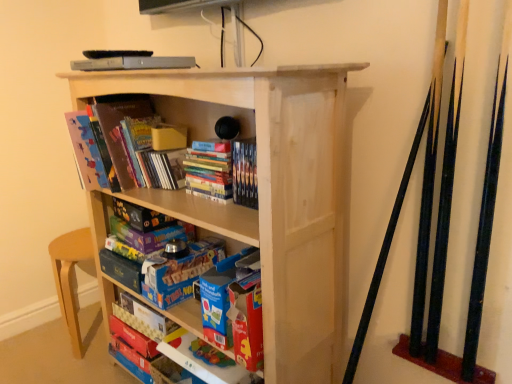
This screenshot has width=512, height=384. What do you see at coordinates (223, 171) in the screenshot?
I see `hardcover books at center, which appears as the 2th book when ordered from the bottom` at bounding box center [223, 171].

Measure the distance between matte cardboard book at left, which appears as the third book when ordered from the bottom, and camera.

matte cardboard book at left, which appears as the third book when ordered from the bottom, and camera are 3.73 feet apart.

The width and height of the screenshot is (512, 384). In order to click on natural wood bookcase at center in this screenshot , I will do `click(268, 193)`.

The height and width of the screenshot is (384, 512). Identify the location of hardcover books at center, which appears as the 2th book when ordered from the bottom. (223, 171).

From a real-world perspective, does hardcover books at center, which appears as the 2th book when ordered from the bottom, sit lower than matte cardboard book at left, which appears as the first book when viewed from the top?

Yes, from a real-world perspective, hardcover books at center, which appears as the 2th book when ordered from the bottom, is under matte cardboard book at left, which appears as the first book when viewed from the top.

Between hardcover books at center, which appears as the 2th book when ordered from the bottom, and matte cardboard book at left, which appears as the first book when viewed from the top, which one is positioned in front?

hardcover books at center, which appears as the 2th book when ordered from the bottom, is closer to the camera.

How much distance is there between hardcover books at center, the 2th book in the top-to-bottom sequence, and matte cardboard book at left, which appears as the third book when ordered from the bottom?

The distance of hardcover books at center, the 2th book in the top-to-bottom sequence, from matte cardboard book at left, which appears as the third book when ordered from the bottom, is 6.91 inches.

Looking at this image, is hardcover books at center, which appears as the 2th book when ordered from the bottom, thinner than matte cardboard book at left, which appears as the third book when ordered from the bottom?

Indeed, hardcover books at center, which appears as the 2th book when ordered from the bottom, has a lesser width compared to matte cardboard book at left, which appears as the third book when ordered from the bottom.

Is matte cardboard book at lower center, which is counted as the 1th book, starting from the bottom, situated inside hardcover books at center, the 2th book in the top-to-bottom sequence, or outside?

matte cardboard book at lower center, which is counted as the 1th book, starting from the bottom, cannot be found inside hardcover books at center, the 2th book in the top-to-bottom sequence.

Considering the relative sizes of matte cardboard book at lower center, which is counted as the 1th book, starting from the bottom, and hardcover books at center, the 2th book in the top-to-bottom sequence, in the image provided, is matte cardboard book at lower center, which is counted as the 1th book, starting from the bottom, taller than hardcover books at center, the 2th book in the top-to-bottom sequence,?

Incorrect, the height of matte cardboard book at lower center, which is counted as the 1th book, starting from the bottom, is not larger of that of hardcover books at center, the 2th book in the top-to-bottom sequence.

From the image's perspective, is matte cardboard book at lower center, which is counted as the 1th book, starting from the bottom, above or below hardcover books at center, which appears as the 2th book when ordered from the bottom?

matte cardboard book at lower center, which is counted as the 1th book, starting from the bottom, is situated lower than hardcover books at center, which appears as the 2th book when ordered from the bottom, in the image.

From a real-world perspective, is matte cardboard book at lower center, positioned as the third book in top-to-bottom order, beneath hardcover books at center, which appears as the 2th book when ordered from the bottom?

Yes, from a real-world perspective, matte cardboard book at lower center, positioned as the third book in top-to-bottom order, is beneath hardcover books at center, which appears as the 2th book when ordered from the bottom.

From their relative heights in the image, would you say matte cardboard book at lower center, positioned as the third book in top-to-bottom order, is taller or shorter than natural wood bookcase at center?

In the image, matte cardboard book at lower center, positioned as the third book in top-to-bottom order, appears to be shorter than natural wood bookcase at center.

Based on the photo, from the image's perspective, between matte cardboard book at lower center, which is counted as the 1th book, starting from the bottom, and natural wood bookcase at center, who is located below?

matte cardboard book at lower center, which is counted as the 1th book, starting from the bottom.

Considering the relative positions of matte cardboard book at lower center, positioned as the third book in top-to-bottom order, and natural wood bookcase at center in the image provided, is matte cardboard book at lower center, positioned as the third book in top-to-bottom order, in front of natural wood bookcase at center?

No, matte cardboard book at lower center, positioned as the third book in top-to-bottom order, is further to the viewer.

From a real-world perspective, does matte cardboard book at lower center, which is counted as the 1th book, starting from the bottom, sit lower than natural wood bookcase at center?

Correct, in the physical world, matte cardboard book at lower center, which is counted as the 1th book, starting from the bottom, is lower than natural wood bookcase at center.

Is matte cardboard book at left, which appears as the first book when viewed from the top, oriented towards natural wood bookcase at center?

Yes, matte cardboard book at left, which appears as the first book when viewed from the top, is facing natural wood bookcase at center.

From the image's perspective, does matte cardboard book at left, which appears as the third book when ordered from the bottom, appear higher than natural wood bookcase at center?

Indeed, from the image's perspective, matte cardboard book at left, which appears as the third book when ordered from the bottom, is shown above natural wood bookcase at center.

Is matte cardboard book at left, which appears as the third book when ordered from the bottom, wider than natural wood bookcase at center?

No, matte cardboard book at left, which appears as the third book when ordered from the bottom, is not wider than natural wood bookcase at center.

Is matte cardboard book at left, which appears as the first book when viewed from the top, bigger than natural wood bookcase at center?

Actually, matte cardboard book at left, which appears as the first book when viewed from the top, might be smaller than natural wood bookcase at center.

Looking at their sizes, would you say natural wood bookcase at center is wider or thinner than matte cardboard book at left, which appears as the third book when ordered from the bottom?

Clearly, natural wood bookcase at center has more width compared to matte cardboard book at left, which appears as the third book when ordered from the bottom.

Considering their positions, is natural wood bookcase at center located in front of or behind matte cardboard book at left, which appears as the first book when viewed from the top?

Clearly, natural wood bookcase at center is in front of matte cardboard book at left, which appears as the first book when viewed from the top.

Is natural wood bookcase at center oriented towards matte cardboard book at left, which appears as the third book when ordered from the bottom?

Yes, natural wood bookcase at center faces towards matte cardboard book at left, which appears as the third book when ordered from the bottom.

Is point (321, 86) less distant than point (164, 173)?

Yes, point (321, 86) is closer to viewer.

At what (x,y) coordinates should I click in order to perform the action: click on book that is the 1st object to the right of the natural wood bookcase at center, starting at the anchor. Please return your answer as a coordinate pair (x, y). The image size is (512, 384). Looking at the image, I should click on (182, 348).

From a real-world perspective, is natural wood bookcase at center on matte cardboard book at lower center, which is counted as the 1th book, starting from the bottom?

Yes, from a real-world perspective, natural wood bookcase at center is over matte cardboard book at lower center, which is counted as the 1th book, starting from the bottom

Which object is wider, natural wood bookcase at center or matte cardboard book at lower center, positioned as the third book in top-to-bottom order?

natural wood bookcase at center.

Is natural wood bookcase at center facing towards matte cardboard book at lower center, positioned as the third book in top-to-bottom order?

Yes, natural wood bookcase at center is oriented towards matte cardboard book at lower center, positioned as the third book in top-to-bottom order.

Which object is positioned more to the right, hardcover books at center, which appears as the 2th book when ordered from the bottom, or matte cardboard book at lower center, which is counted as the 1th book, starting from the bottom?

hardcover books at center, which appears as the 2th book when ordered from the bottom.

What's the angular difference between hardcover books at center, the 2th book in the top-to-bottom sequence, and matte cardboard book at lower center, which is counted as the 1th book, starting from the bottom,'s facing directions?

hardcover books at center, the 2th book in the top-to-bottom sequence, and matte cardboard book at lower center, which is counted as the 1th book, starting from the bottom, are facing 1.89 degrees away from each other.

In the scene shown: Is hardcover books at center, the 2th book in the top-to-bottom sequence, in front of or behind matte cardboard book at lower center, positioned as the third book in top-to-bottom order, in the image?

Clearly, hardcover books at center, the 2th book in the top-to-bottom sequence, is in front of matte cardboard book at lower center, positioned as the third book in top-to-bottom order.

Locate an element on the screen. This screenshot has width=512, height=384. book that is the 1st one when counting leftward from the hardcover books at center, the 2th book in the top-to-bottom sequence is located at coordinates (182, 348).

Starting from the matte cardboard book at left, which appears as the third book when ordered from the bottom, which book is the 2nd one to the right? Please provide its 2D coordinates.

[(223, 171)]

Where is `book below the hardcover books at center, the 2th book in the top-to-bottom sequence (from a real-world perspective)`? The width and height of the screenshot is (512, 384). book below the hardcover books at center, the 2th book in the top-to-bottom sequence (from a real-world perspective) is located at coordinates (182, 348).

Estimate the real-world distances between objects in this image. Which object is further from matte cardboard book at left, which appears as the third book when ordered from the bottom, natural wood bookcase at center or matte cardboard book at lower center, which is counted as the 1th book, starting from the bottom?

The object further to matte cardboard book at left, which appears as the third book when ordered from the bottom, is matte cardboard book at lower center, which is counted as the 1th book, starting from the bottom.

When comparing their distances from matte cardboard book at lower center, positioned as the third book in top-to-bottom order, does hardcover books at center, the 2th book in the top-to-bottom sequence, or matte cardboard book at left, which appears as the third book when ordered from the bottom, seem closer?

The object closer to matte cardboard book at lower center, positioned as the third book in top-to-bottom order, is hardcover books at center, the 2th book in the top-to-bottom sequence.

Based on their spatial positions, is matte cardboard book at left, which appears as the third book when ordered from the bottom, or natural wood bookcase at center closer to hardcover books at center, the 2th book in the top-to-bottom sequence?

matte cardboard book at left, which appears as the third book when ordered from the bottom, lies closer to hardcover books at center, the 2th book in the top-to-bottom sequence, than the other object.

Looking at the image, which one is located further to natural wood bookcase at center, hardcover books at center, which appears as the 2th book when ordered from the bottom, or matte cardboard book at lower center, positioned as the third book in top-to-bottom order?

The object further to natural wood bookcase at center is matte cardboard book at lower center, positioned as the third book in top-to-bottom order.

Based on their spatial positions, is natural wood bookcase at center or matte cardboard book at lower center, which is counted as the 1th book, starting from the bottom, further from hardcover books at center, the 2th book in the top-to-bottom sequence?

Among the two, matte cardboard book at lower center, which is counted as the 1th book, starting from the bottom, is located further to hardcover books at center, the 2th book in the top-to-bottom sequence.

From the image, which object appears to be farther from hardcover books at center, which appears as the 2th book when ordered from the bottom, natural wood bookcase at center or matte cardboard book at left, which appears as the first book when viewed from the top?

natural wood bookcase at center is further to hardcover books at center, which appears as the 2th book when ordered from the bottom.

From the picture: Estimate the real-world distances between objects in this image. Which object is further from hardcover books at center, the 2th book in the top-to-bottom sequence, matte cardboard book at left, which appears as the third book when ordered from the bottom, or matte cardboard book at lower center, positioned as the third book in top-to-bottom order?

Among the two, matte cardboard book at lower center, positioned as the third book in top-to-bottom order, is located further to hardcover books at center, the 2th book in the top-to-bottom sequence.

Considering their positions, is hardcover books at center, the 2th book in the top-to-bottom sequence, positioned closer to matte cardboard book at left, which appears as the first book when viewed from the top, than natural wood bookcase at center?

Among the two, hardcover books at center, the 2th book in the top-to-bottom sequence, is located nearer to matte cardboard book at left, which appears as the first book when viewed from the top.

I want to click on bookcase between hardcover books at center, the 2th book in the top-to-bottom sequence, and matte cardboard book at lower center, positioned as the third book in top-to-bottom order, vertically, so click(268, 193).

The width and height of the screenshot is (512, 384). Identify the location of bookcase that lies between matte cardboard book at left, which appears as the first book when viewed from the top, and matte cardboard book at lower center, positioned as the third book in top-to-bottom order, from top to bottom. (268, 193).

I want to click on book between matte cardboard book at left, which appears as the third book when ordered from the bottom, and matte cardboard book at lower center, which is counted as the 1th book, starting from the bottom, in the up-down direction, so click(x=223, y=171).